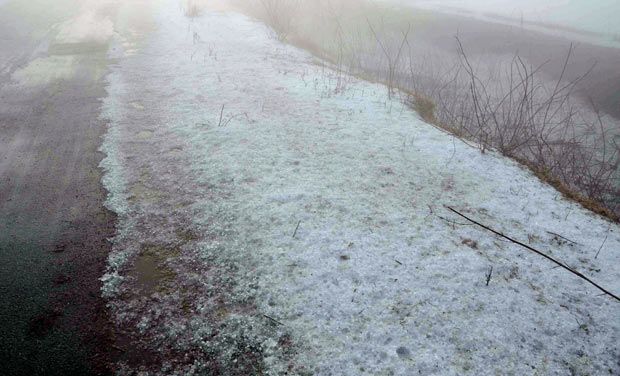
Identify the location of corner. The height and width of the screenshot is (376, 620). (590, 361).